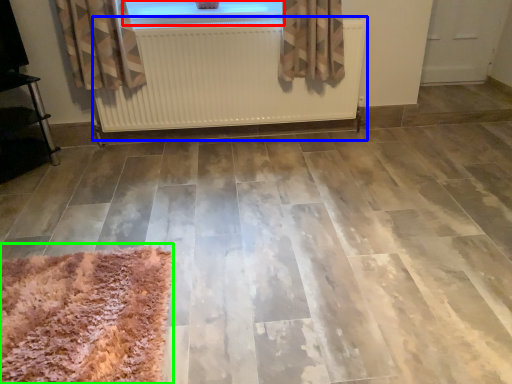
Question: Estimate the real-world distances between objects in this image. Which object is closer to window (highlighted by a red box), radiator (highlighted by a blue box) or mat (highlighted by a green box)?

Choices:
 (A) radiator
 (B) mat

Answer: (A)